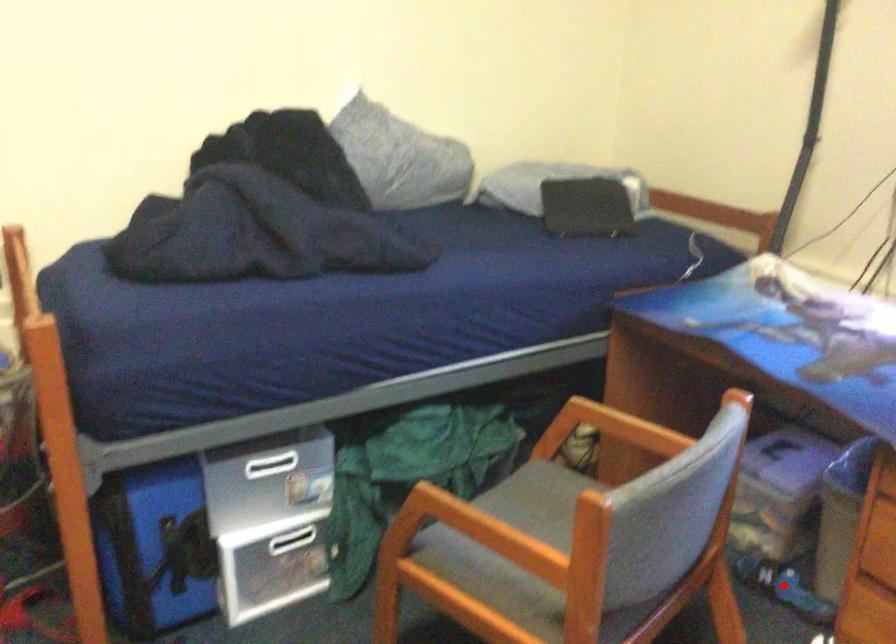
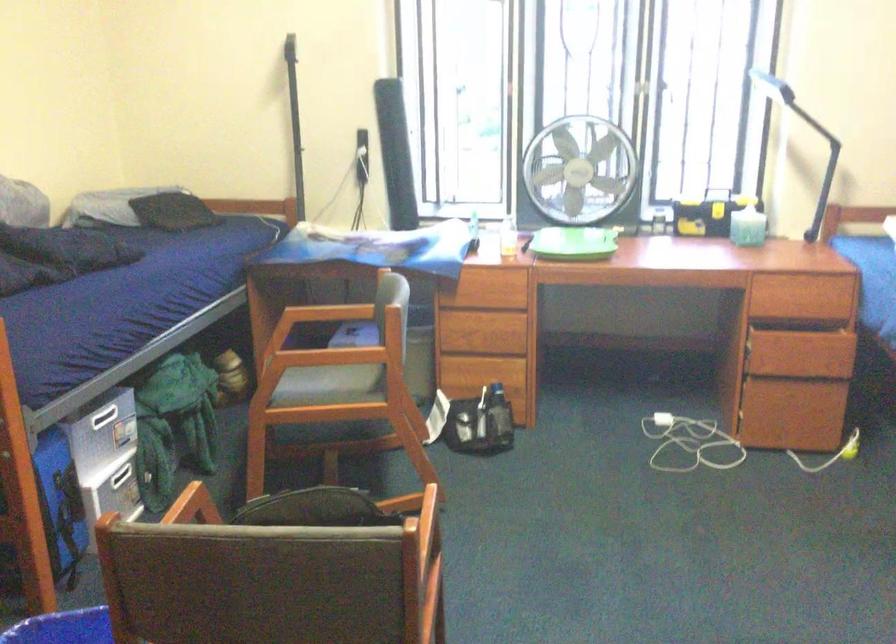
Question: I am providing you with two images of the same scene from different viewpoints. A red point is marked on the first image. Is the red point's position out of view in image 2?

Choices:
 (A) Yes
 (B) No

Answer: (A)